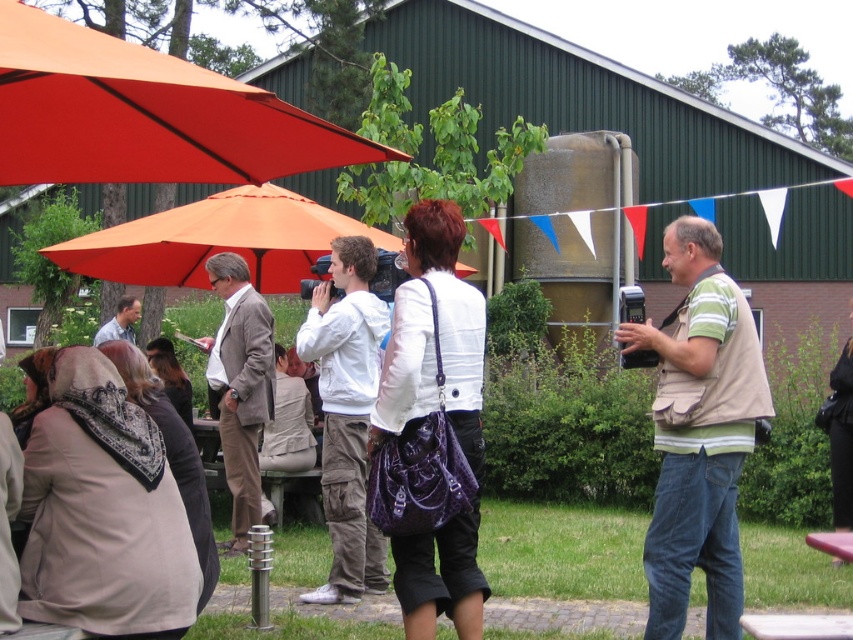
Question: Can you confirm if orange fabric canopy at upper left is positioned above white cotton hoodie at center?

Choices:
 (A) yes
 (B) no

Answer: (A)

Question: Based on their relative distances, which object is nearer to the velvet purple bag at center?

Choices:
 (A) orange fabric umbrella at left
 (B) khaki vest at right

Answer: (B)

Question: Among these objects, which one is farthest from the camera?

Choices:
 (A) velvet purple bag at center
 (B) wooden picnic table at lower right
 (C) white cotton hoodie at center
 (D) light brown fabric suit at center

Answer: (D)

Question: In this image, where is orange fabric canopy at upper left located relative to velvet purple bag at center?

Choices:
 (A) right
 (B) left

Answer: (B)

Question: Does orange fabric canopy at upper left appear on the left side of white cotton hoodie at center?

Choices:
 (A) no
 (B) yes

Answer: (B)

Question: Which object is positioned closest to the orange fabric canopy at upper left?

Choices:
 (A) velvet purple bag at center
 (B) light brown fabric suit at center
 (C) white cotton hoodie at center
 (D) orange fabric umbrella at left

Answer: (A)